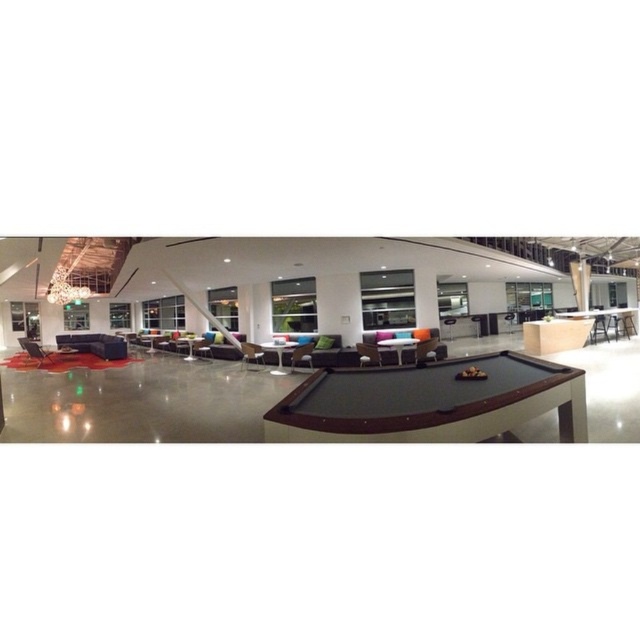
In the scene shown: Can you confirm if dark brown wood pool table at center is wider than matte gray armchair at center?

Indeed, dark brown wood pool table at center has a greater width compared to matte gray armchair at center.

Does dark brown wood pool table at center appear over matte gray armchair at center?

Indeed, dark brown wood pool table at center is positioned over matte gray armchair at center.

Does point (570, 442) lie in front of point (260, 360)?

Yes, point (570, 442) is in front of point (260, 360).

The width and height of the screenshot is (640, 640). Find the location of `dark brown wood pool table at center`. dark brown wood pool table at center is located at coordinates coord(429,401).

Does matte black armchair at left have a smaller size compared to green fabric armchair at center?

No.

I want to click on matte black armchair at left, so click(36, 353).

What do you see at coordinates (36, 353) in the screenshot? The height and width of the screenshot is (640, 640). I see `matte black armchair at left` at bounding box center [36, 353].

I want to click on matte black armchair at left, so click(x=36, y=353).

Can you confirm if matte gray armchair at center is shorter than green fabric armchair at center?

Yes, matte gray armchair at center is shorter than green fabric armchair at center.

Does matte gray armchair at center lie in front of green fabric armchair at center?

That is False.

Does point (253, 353) come closer to viewer compared to point (304, 358)?

No, (253, 353) is behind (304, 358).

Where is `matte gray armchair at center`? The width and height of the screenshot is (640, 640). matte gray armchair at center is located at coordinates (252, 353).